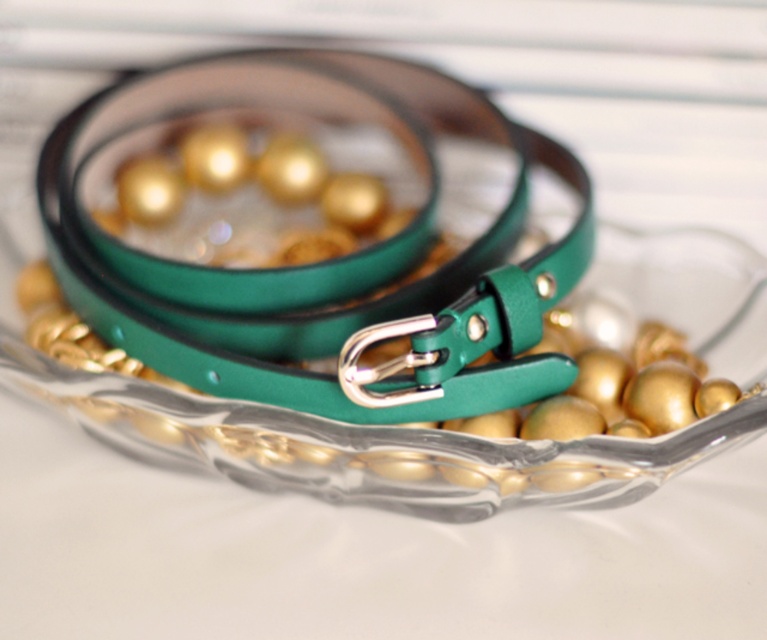
Between green leather belt at center and transparent glass bowl at center, which one has more height?

With more height is green leather belt at center.

Who is shorter, green leather belt at center or transparent glass bowl at center?

transparent glass bowl at center

Is point (410, 394) closer to camera compared to point (199, 460)?

Yes, it is.

Image resolution: width=767 pixels, height=640 pixels. Find the location of `green leather belt at center`. green leather belt at center is located at coordinates (310, 225).